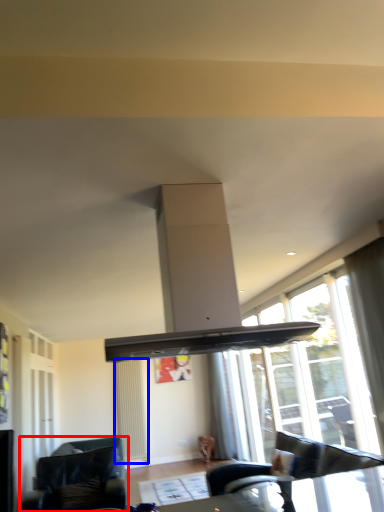
Question: Which object is further to the camera taking this photo, studio couch (highlighted by a red box) or radiator (highlighted by a blue box)?

Choices:
 (A) studio couch
 (B) radiator

Answer: (B)